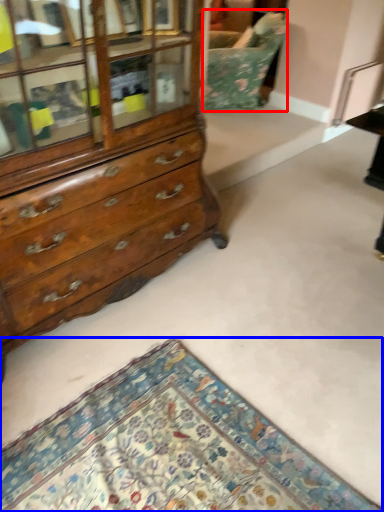
Question: Which of the following is the farthest to the observer, swivel chair (highlighted by a red box) or mat (highlighted by a blue box)?

Choices:
 (A) swivel chair
 (B) mat

Answer: (A)